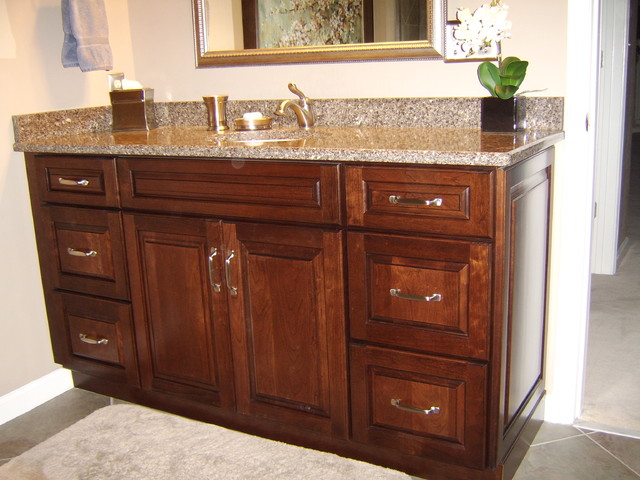
This screenshot has width=640, height=480. I want to click on tissue box, so click(130, 81).